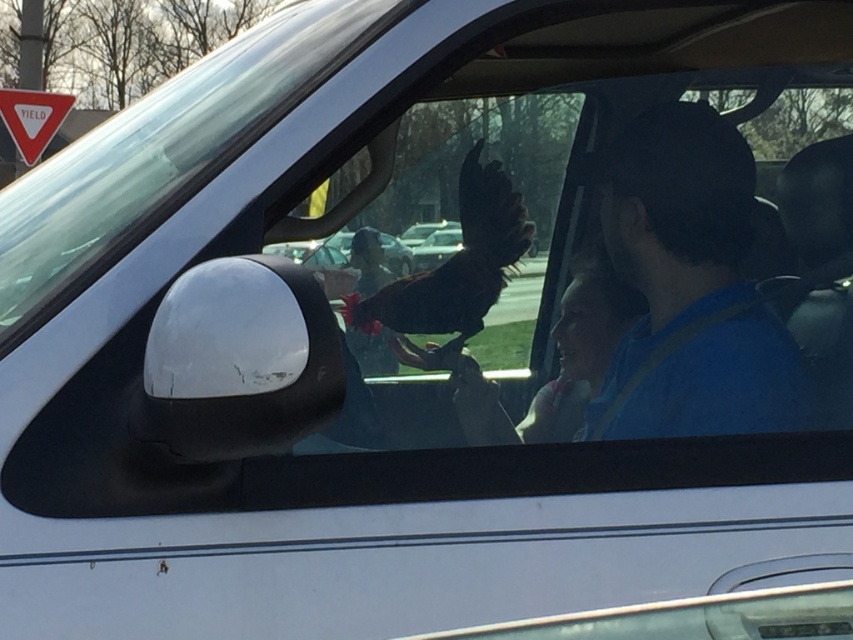
Is point (717, 410) positioned before point (9, 109)?

Yes, point (717, 410) is closer to viewer.

The height and width of the screenshot is (640, 853). In order to click on transparent glass windshield at center in this screenshot , I will do `click(589, 244)`.